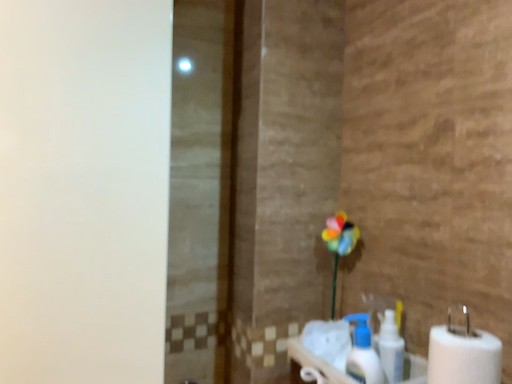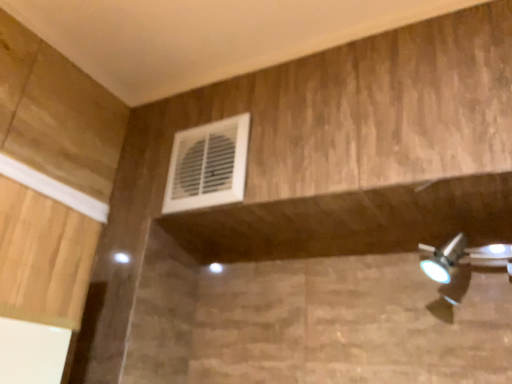
Question: How did the camera likely rotate when shooting the video?

Choices:
 (A) rotated left
 (B) rotated right

Answer: (B)